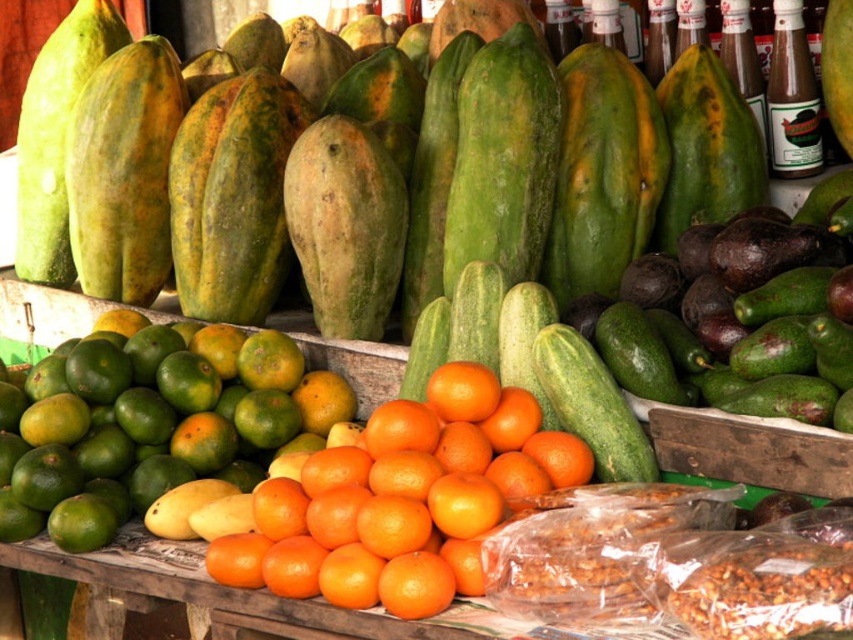
Question: Can you confirm if orangesmoothorange at center is positioned to the left of green matte avocado at right?

Choices:
 (A) no
 (B) yes

Answer: (B)

Question: Which of the following is the closest to the observer?

Choices:
 (A) green matte avocado at right
 (B) orangesmoothorange at center

Answer: (B)

Question: Among these objects, which one is nearest to the camera?

Choices:
 (A) orangesmoothorange at center
 (B) green matte mangoes at center
 (C) green matte avocado at right

Answer: (A)

Question: Which object appears farthest from the camera in this image?

Choices:
 (A) green matte mangoes at center
 (B) orangesmoothorange at center

Answer: (A)

Question: Is orangesmoothorange at center positioned in front of green matte avocado at right?

Choices:
 (A) yes
 (B) no

Answer: (A)

Question: Can you confirm if orangesmoothorange at center is positioned to the left of green matte avocado at right?

Choices:
 (A) yes
 (B) no

Answer: (A)